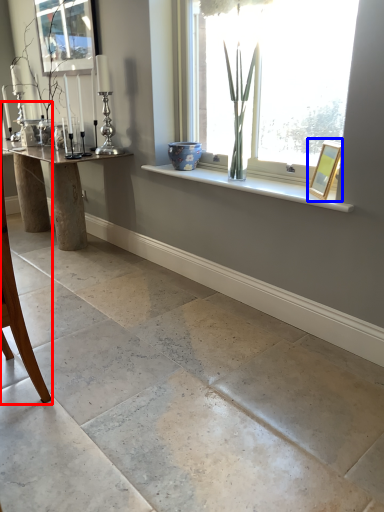
Question: Which object is further to the camera taking this photo, armchair (highlighted by a red box) or picture frame (highlighted by a blue box)?

Choices:
 (A) armchair
 (B) picture frame

Answer: (B)